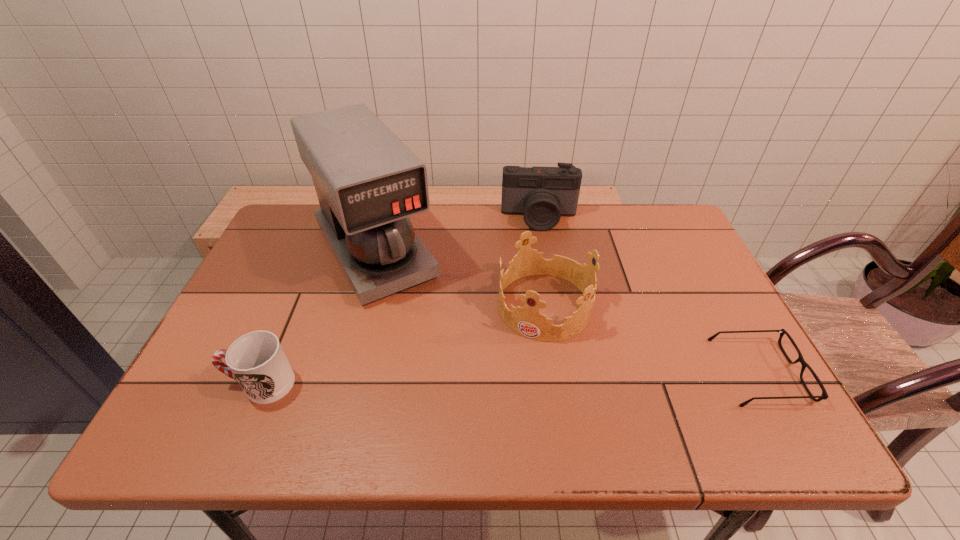
Locate an element on the screen. This screenshot has width=960, height=540. vacant region that satisfies the following two spatial constraints: 1. on the front side of the tiara; 2. on the front-facing side of the spectacles is located at coordinates (554, 372).

Find the location of a particular element. The height and width of the screenshot is (540, 960). free location that satisfies the following two spatial constraints: 1. on the front side of the tiara; 2. on the front-facing side of the rightmost object is located at coordinates (554, 372).